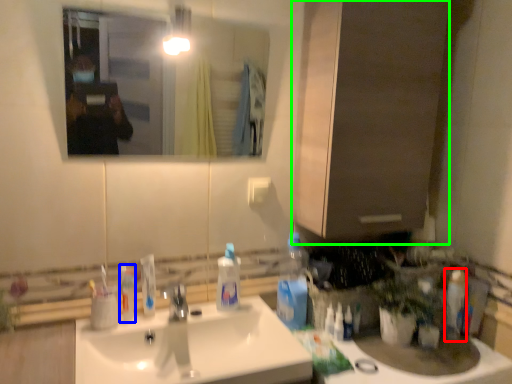
Question: Estimate the real-world distances between objects in this image. Which object is closer to toiletry (highlighted by a red box), mouthwash (highlighted by a blue box) or cabinetry (highlighted by a green box)?

Choices:
 (A) mouthwash
 (B) cabinetry

Answer: (B)